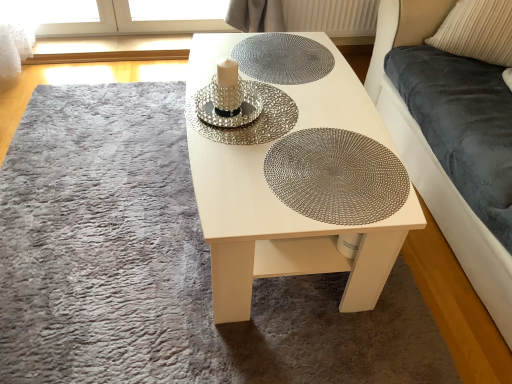
Locate an element on the screen. Image resolution: width=512 pixels, height=384 pixels. vacant area located to the right-hand side of silver metallic plate at center, the second glass plate from the top is located at coordinates (334, 104).